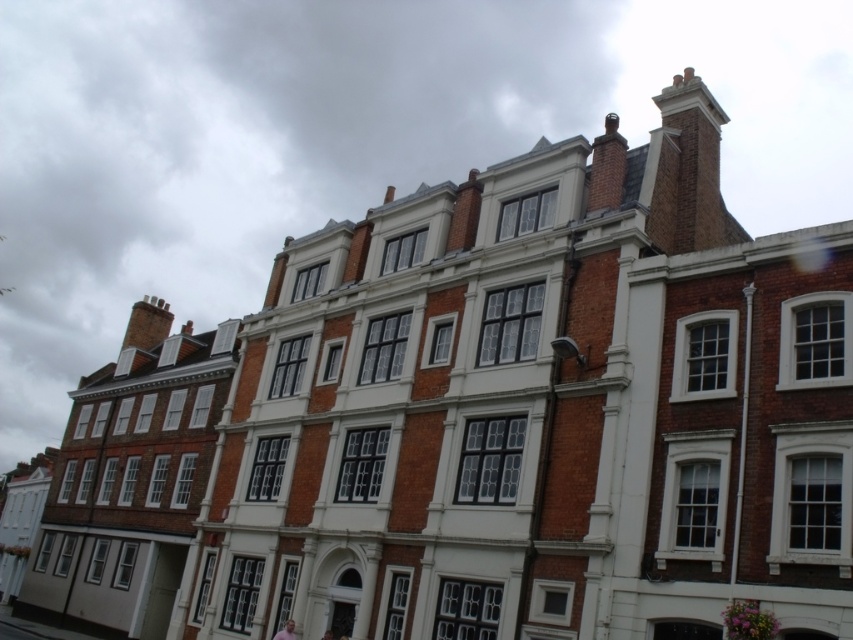
You are standing in front of the row of traditional brick buildings. There is a pink fabric at center located at point (286, 632). What is the color of the fabric at that point?

The pink fabric at center located at point (286, 632) is pink in color.

You are standing in front of the row of traditional brick buildings and notice a pink fabric at center. Where exactly is the pink fabric located in relation to the buildings?

The pink fabric at center is located at point coordinates approximately 0.988 along the horizontal axis and 0.336 along the vertical axis relative to the image frame.